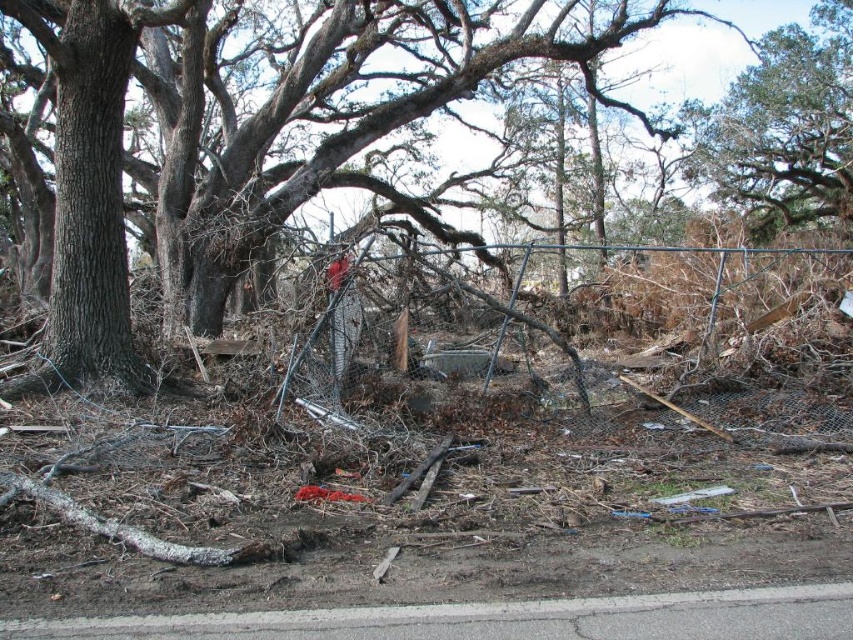
You are a rescue worker assessing the scene. You need to determine the relative positions of the brown textured tree at center and the green leafy tree at upper right. Which tree is positioned to the left of the other?

The brown textured tree at center is to the left of the green leafy tree at upper right.

You are a rescue worker trying to locate a brown textured tree at center in a storm damaged area. The coordinates given are point (262, 136). Can you confirm if this point marks the location of the brown textured tree at center?

Yes, the point (262, 136) marks the brown textured tree at center, so this is the correct location.